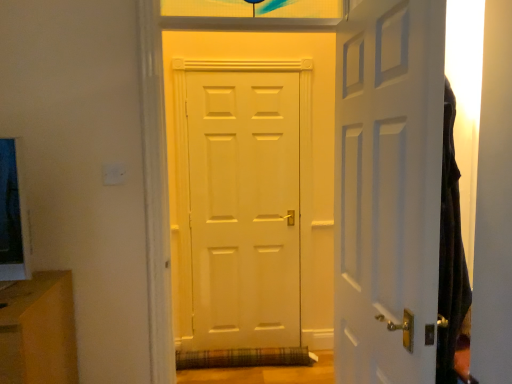
Question: Considering the positions of white matte door at center, which is counted as the first door, starting from the left, and white matte door at right, the second door in the left-to-right sequence, in the image, is white matte door at center, which is counted as the first door, starting from the left, bigger or smaller than white matte door at right, the second door in the left-to-right sequence,?

Choices:
 (A) big
 (B) small

Answer: (A)

Question: From their relative heights in the image, would you say white matte door at center, which is the 2th door from right to left, is taller or shorter than white matte door at right, arranged as the 1th door when viewed from the right?

Choices:
 (A) tall
 (B) short

Answer: (A)

Question: Does point (292, 140) appear closer or farther from the camera than point (424, 279)?

Choices:
 (A) closer
 (B) farther

Answer: (B)

Question: Looking at their shapes, would you say white matte door at right, arranged as the 1th door when viewed from the right, is wider or thinner than white matte door at center, which is the 2th door from right to left?

Choices:
 (A) thin
 (B) wide

Answer: (A)

Question: From the image's perspective, is white matte door at right, arranged as the 1th door when viewed from the right, located above or below white matte door at center, which is counted as the first door, starting from the left?

Choices:
 (A) below
 (B) above

Answer: (A)

Question: Would you say white matte door at right, arranged as the 1th door when viewed from the right, is to the left or to the right of white matte door at center, which is counted as the first door, starting from the left, in the picture?

Choices:
 (A) left
 (B) right

Answer: (B)

Question: Considering their positions, is white matte door at right, arranged as the 1th door when viewed from the right, located in front of or behind white matte door at center, which is the 2th door from right to left?

Choices:
 (A) behind
 (B) front

Answer: (B)